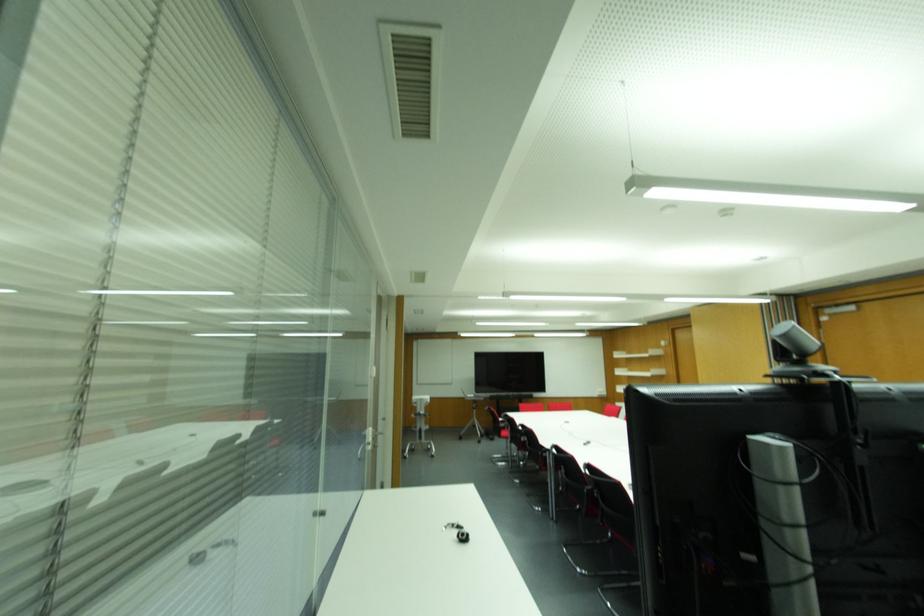
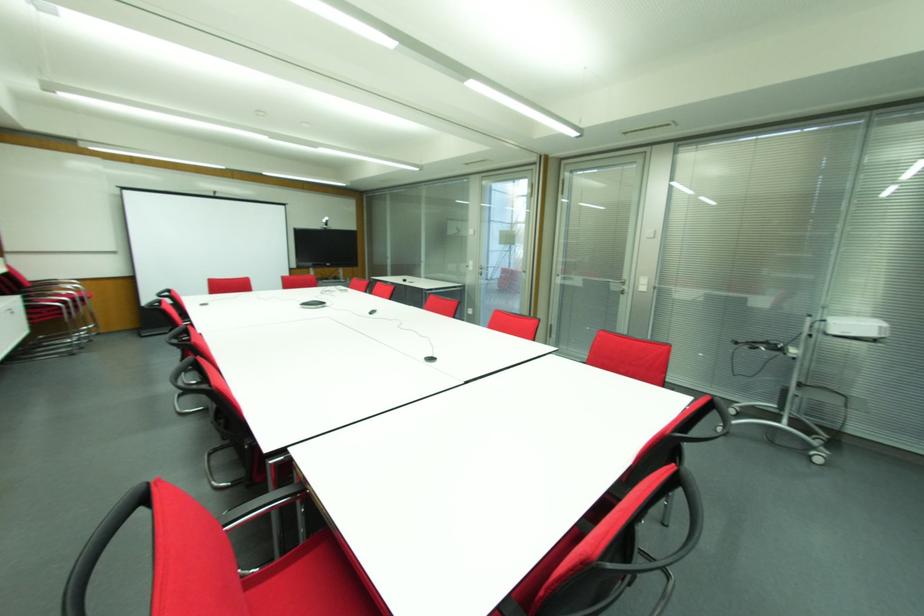
Question: I am providing you with two images of the same scene from different viewpoints. After the viewpoint changes to image2, which objects are now occluded?

Choices:
 (A) white paper towel roll
 (B) black chair armrest
 (C) red chair sitting surface
 (D) black conference microphone

Answer: (C)